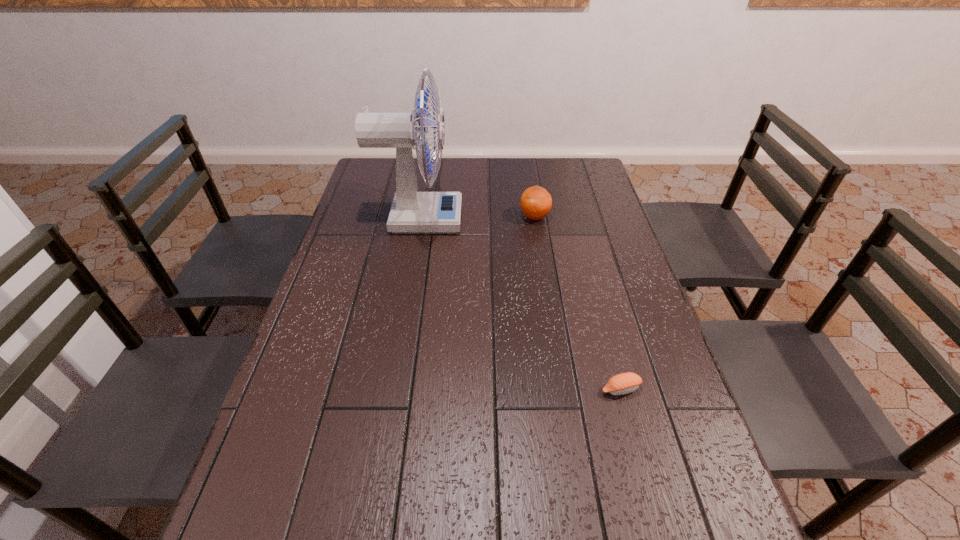
I want to click on fan, so click(411, 211).

What are the coordinates of `the tallest object` in the screenshot? It's located at (411, 211).

Locate an element on the screen. The height and width of the screenshot is (540, 960). orange is located at coordinates (536, 202).

Identify the location of the second object from left to right. The width and height of the screenshot is (960, 540). (536, 202).

Locate an element on the screen. The image size is (960, 540). the nearest object is located at coordinates (x=624, y=383).

Where is `sushi`? The height and width of the screenshot is (540, 960). sushi is located at coordinates (624, 383).

At what (x,y) coordinates should I click in order to perform the action: click on vacant space located on the front-facing side of the tallest object. Please return your answer as a coordinate pair (x, y). Looking at the image, I should click on (510, 219).

Identify the location of vacant space located on the back of the orange. The width and height of the screenshot is (960, 540). (528, 173).

The width and height of the screenshot is (960, 540). Identify the location of free region located on the front of the sushi. (641, 465).

Find the location of `object that is positioned at the left edge`. object that is positioned at the left edge is located at coordinates (411, 211).